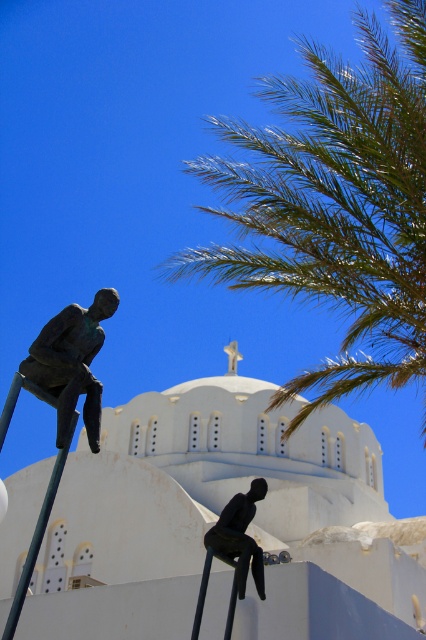
You are standing at the origin point in the image. The church is at point (216,518). If you want to walk directly towards the church, which direction should you move? Please answer with either north, south, east, or west.

Since the point (216,518) corresponds to the white smooth church at center, you should move north to reach it.

Looking at the scene with the white smooth church at center and the green leafy palm at upper right, which object is positioned to the left of the other?

The white smooth church at center is positioned to the left of the green leafy palm at upper right.

You are an artist planning to paint the scene. You want to ensure the proportions between the green leafy palm at upper right and the bronze statue at left are accurate. Which object should you make wider in your painting?

The green leafy palm at upper right should be painted wider than the bronze statue at left since its width is larger according to the description.